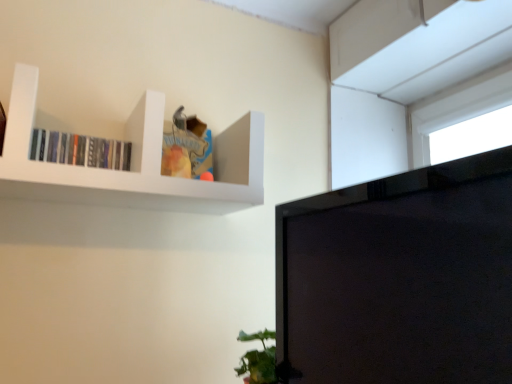
Question: Is matte black books at upper left at the left side of white matte shelf at upper left?

Choices:
 (A) yes
 (B) no

Answer: (A)

Question: Is matte black books at upper left oriented towards white matte shelf at upper left?

Choices:
 (A) yes
 (B) no

Answer: (A)

Question: From the image's perspective, is matte black books at upper left on top of white matte shelf at upper left?

Choices:
 (A) yes
 (B) no

Answer: (A)

Question: Considering the relative positions of matte black books at upper left and white matte shelf at upper left in the image provided, is matte black books at upper left to the right of white matte shelf at upper left from the viewer's perspective?

Choices:
 (A) yes
 (B) no

Answer: (B)

Question: Is matte black books at upper left next to white matte shelf at upper left and touching it?

Choices:
 (A) no
 (B) yes

Answer: (A)

Question: Considering the relative sizes of matte black books at upper left and white matte shelf at upper left in the image provided, is matte black books at upper left bigger than white matte shelf at upper left?

Choices:
 (A) yes
 (B) no

Answer: (B)

Question: Is white matte shelf at upper left wider than black glossy monitor at upper right?

Choices:
 (A) yes
 (B) no

Answer: (A)

Question: Considering the relative sizes of white matte shelf at upper left and black glossy monitor at upper right in the image provided, is white matte shelf at upper left shorter than black glossy monitor at upper right?

Choices:
 (A) no
 (B) yes

Answer: (B)

Question: Would you say white matte shelf at upper left is a long distance from black glossy monitor at upper right?

Choices:
 (A) yes
 (B) no

Answer: (B)

Question: Does white matte shelf at upper left touch black glossy monitor at upper right?

Choices:
 (A) yes
 (B) no

Answer: (B)

Question: Is white matte shelf at upper left thinner than black glossy monitor at upper right?

Choices:
 (A) yes
 (B) no

Answer: (B)

Question: From a real-world perspective, is white matte shelf at upper left on top of black glossy monitor at upper right?

Choices:
 (A) yes
 (B) no

Answer: (A)

Question: Would you say black glossy monitor at upper right is outside white matte shelf at upper left?

Choices:
 (A) no
 (B) yes

Answer: (B)